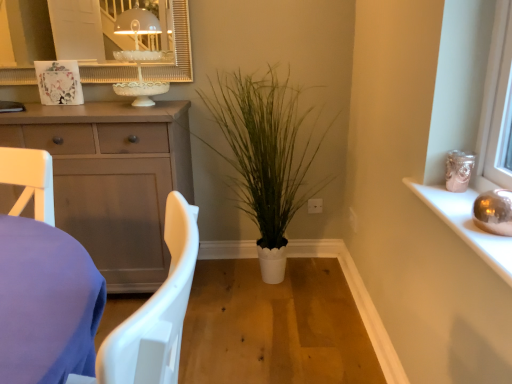
Describe the element at coordinates (467, 225) in the screenshot. I see `metallic silver sphere at upper right` at that location.

You are a GUI agent. You are given a task and a screenshot of the screen. Output one action in this format:
    pyautogui.click(x=<x>, y=<y>)
    Task: Click on the matte gray cabinet at left
    
    Given the screenshot: What is the action you would take?
    pyautogui.click(x=112, y=179)

Measure the distance between white porcelain candle holder at upper center and camera.

They are 6.34 feet apart.

Where is `metallic silver sphere at upper right`? metallic silver sphere at upper right is located at coordinates (467, 225).

What's the angular difference between white textured mirror at upper center and white matte plant at center's facing directions?

0.367 degrees separate the facing orientations of white textured mirror at upper center and white matte plant at center.

Is white textured mirror at upper center spatially inside white matte plant at center, or outside of it?

white textured mirror at upper center lies outside white matte plant at center.

Is white textured mirror at upper center at the right side of white matte plant at center?

No, white textured mirror at upper center is not to the right of white matte plant at center.

Is white textured mirror at upper center aimed at white matte plant at center?

No, white textured mirror at upper center is not facing towards white matte plant at center.

You are a GUI agent. You are given a task and a screenshot of the screen. Output one action in this format:
    pyautogui.click(x=<x>, y=<y>)
    Task: Click on the houseplant that appears on the right of matte gray cabinet at left
    
    Given the screenshot: What is the action you would take?
    pyautogui.click(x=265, y=155)

Is point (184, 162) in front of point (220, 129)?

Yes, it is.

Is matte gray cabinet at left not close to white matte plant at center?

No, there isn't a large distance between matte gray cabinet at left and white matte plant at center.

Does matte gray cabinet at left turn towards white matte plant at center?

No, matte gray cabinet at left is not oriented towards white matte plant at center.

From a real-world perspective, is matte gray cabinet at left positioned under white plastic chair at lower left based on gravity?

Correct, in the physical world, matte gray cabinet at left is lower than white plastic chair at lower left.

Image resolution: width=512 pixels, height=384 pixels. I want to click on chair on the right of matte gray cabinet at left, so click(42, 283).

From the image's perspective, is matte gray cabinet at left on white plastic chair at lower left?

Yes, from the image's perspective, matte gray cabinet at left is on top of white plastic chair at lower left.

Is there a large distance between matte gray cabinet at left and white plastic chair at lower left?

matte gray cabinet at left is near white plastic chair at lower left, not far away.

From the image's perspective, is metallic silver sphere at upper right positioned above or below white porcelain candle holder at upper center?

metallic silver sphere at upper right is situated lower than white porcelain candle holder at upper center in the image.

Which is less distant, (433, 202) or (131, 56)?

Point (433, 202) is closer to the camera than point (131, 56).

Can you see metallic silver sphere at upper right touching white porcelain candle holder at upper center?

They are not placed beside each other.

The image size is (512, 384). In order to click on window sill located underneath the white porcelain candle holder at upper center (from a real-world perspective) in this screenshot , I will do `click(467, 225)`.

How many degrees apart are the facing directions of white porcelain candle holder at upper center and matte gray cabinet at left?

white porcelain candle holder at upper center and matte gray cabinet at left are facing 1.03 degrees away from each other.

Locate an element on the screen. This screenshot has width=512, height=384. cabinetry on the left of white porcelain candle holder at upper center is located at coordinates (112, 179).

Can you see white porcelain candle holder at upper center touching matte gray cabinet at left?

white porcelain candle holder at upper center and matte gray cabinet at left are not in contact.

From a real-world perspective, between white porcelain candle holder at upper center and white textured mirror at upper center, who is vertically higher?

white textured mirror at upper center.

From the image's perspective, which object appears higher, white porcelain candle holder at upper center or white textured mirror at upper center?

white textured mirror at upper center.

Is point (153, 50) positioned behind point (190, 53)?

Yes, point (153, 50) is behind point (190, 53).

Who is shorter, white porcelain candle holder at upper center or white textured mirror at upper center?

white porcelain candle holder at upper center is shorter.

Considering the relative sizes of white plastic chair at lower left and white matte plant at center in the image provided, is white plastic chair at lower left bigger than white matte plant at center?

Actually, white plastic chair at lower left might be smaller than white matte plant at center.

Which is behind, white plastic chair at lower left or white matte plant at center?

white matte plant at center is further from the camera.

From a real-world perspective, which is physically above, white plastic chair at lower left or white matte plant at center?

white matte plant at center.

The image size is (512, 384). What are the coordinates of `mirror that is above the white matte plant at center (from a real-world perspective)` in the screenshot? It's located at (176, 50).

The height and width of the screenshot is (384, 512). Find the location of `cabinetry that appears below the white matte plant at center (from the image's perspective)`. cabinetry that appears below the white matte plant at center (from the image's perspective) is located at coordinates (x=112, y=179).

Estimate the real-world distances between objects in this image. Which object is closer to white plastic chair at lower left, matte gray cabinet at left or white textured mirror at upper center?

Based on the image, matte gray cabinet at left appears to be nearer to white plastic chair at lower left.

When comparing their distances from white matte plant at center, does metallic silver sphere at upper right or white porcelain candle holder at upper center seem closer?

The object closer to white matte plant at center is white porcelain candle holder at upper center.

Estimate the real-world distances between objects in this image. Which object is further from white porcelain candle holder at upper center, matte gray cabinet at left or metallic silver sphere at upper right?

The object further to white porcelain candle holder at upper center is metallic silver sphere at upper right.

Looking at the image, which one is located closer to matte gray cabinet at left, white matte plant at center or white plastic chair at lower left?

The object closer to matte gray cabinet at left is white matte plant at center.

Which object lies further to the anchor point white matte plant at center, white plastic chair at lower left or matte gray cabinet at left?

Among the two, white plastic chair at lower left is located further to white matte plant at center.

Which object lies nearer to the anchor point white plastic chair at lower left, white porcelain candle holder at upper center or white textured mirror at upper center?

Based on the image, white porcelain candle holder at upper center appears to be nearer to white plastic chair at lower left.

Estimate the real-world distances between objects in this image. Which object is closer to white porcelain candle holder at upper center, white plastic chair at lower left or white matte plant at center?

Among the two, white matte plant at center is located nearer to white porcelain candle holder at upper center.

Which object lies further to the anchor point matte gray cabinet at left, white matte plant at center or metallic silver sphere at upper right?

metallic silver sphere at upper right is further to matte gray cabinet at left.

This screenshot has height=384, width=512. I want to click on houseplant between white textured mirror at upper center and metallic silver sphere at upper right, so click(265, 155).

Identify the location of houseplant between white plastic chair at lower left and white porcelain candle holder at upper center from front to back. (265, 155).

Find the location of a particular element. The image size is (512, 384). candle holder situated between white textured mirror at upper center and white matte plant at center from left to right is located at coordinates (139, 55).

Identify the location of candle holder between white textured mirror at upper center and metallic silver sphere at upper right from left to right. Image resolution: width=512 pixels, height=384 pixels. tap(139, 55).